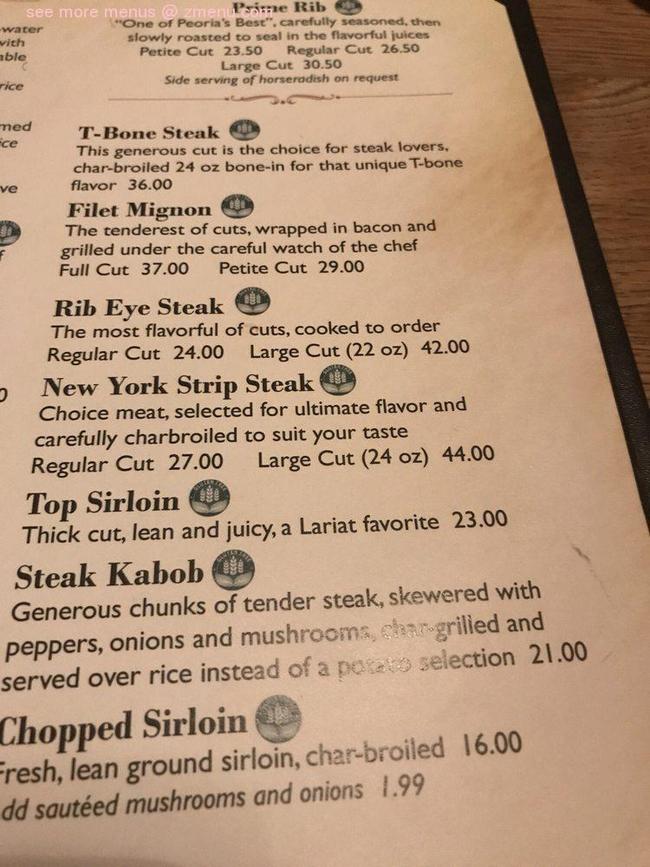
You are a GUI agent. You are given a task and a screenshot of the screen. Output one action in this format:
    pyautogui.click(x=<x>, y=<y>)
    Task: Click on the scuff marks
    This screenshot has width=650, height=867.
    Given the screenshot: What is the action you would take?
    pyautogui.click(x=587, y=557), pyautogui.click(x=612, y=654)